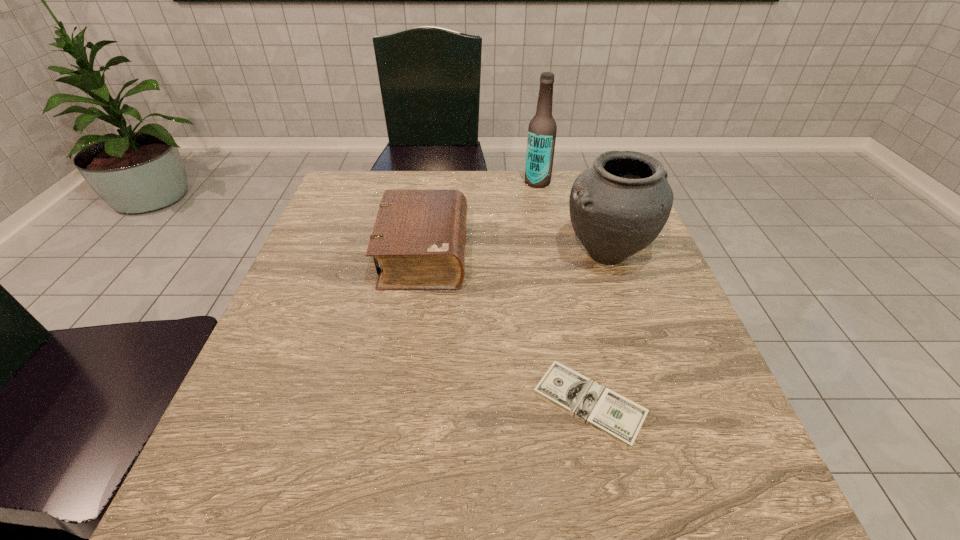
Where is `object that stands as the closest to the dollar`? The image size is (960, 540). object that stands as the closest to the dollar is located at coordinates (618, 206).

Find the location of a particular element. object that is the second closest to the urn is located at coordinates (615, 416).

You are a GUI agent. You are given a task and a screenshot of the screen. Output one action in this format:
    pyautogui.click(x=<x>, y=<y>)
    Task: Click on the blank space that satisfies the following two spatial constraints: 1. on the label of the shortest object; 2. on the left side of the beer bottle
    This screenshot has height=540, width=960.
    Given the screenshot: What is the action you would take?
    pyautogui.click(x=580, y=404)

Where is `vacant space that satisfies the following two spatial constraints: 1. on the label of the third shortest object; 2. on the left side of the beer bottle`? vacant space that satisfies the following two spatial constraints: 1. on the label of the third shortest object; 2. on the left side of the beer bottle is located at coordinates (551, 254).

Find the location of a particular element. The width and height of the screenshot is (960, 540). vacant space that satisfies the following two spatial constraints: 1. on the label of the farthest object; 2. on the back side of the nearest object is located at coordinates (580, 404).

You are a GUI agent. You are given a task and a screenshot of the screen. Output one action in this format:
    pyautogui.click(x=<x>, y=<y>)
    Task: Click on the free spot that satisfies the following two spatial constraints: 1. on the spine side of the Bible; 2. on the back side of the dollar
    Image resolution: width=960 pixels, height=540 pixels.
    Given the screenshot: What is the action you would take?
    pyautogui.click(x=402, y=404)

The image size is (960, 540). I want to click on free space that satisfies the following two spatial constraints: 1. on the label of the dollar; 2. on the right side of the beer bottle, so click(580, 404).

Identify the location of free location that satisfies the following two spatial constraints: 1. on the back side of the shortest object; 2. on the right side of the urn. (558, 254).

This screenshot has height=540, width=960. What are the coordinates of `vacant space that satisfies the following two spatial constraints: 1. on the label of the beer bottle; 2. on the right side of the dollar` in the screenshot? It's located at (580, 404).

Identify the location of vacant region that satisfies the following two spatial constraints: 1. on the label of the beer bottle; 2. on the left side of the urn. (551, 254).